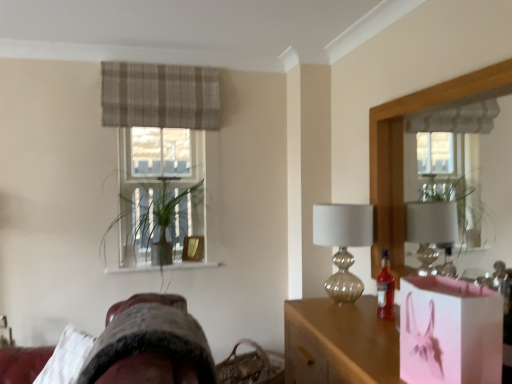
The height and width of the screenshot is (384, 512). What are the coordinates of `free space above pink glossy bag at center (from a real-world perspective)` in the screenshot? It's located at (357, 329).